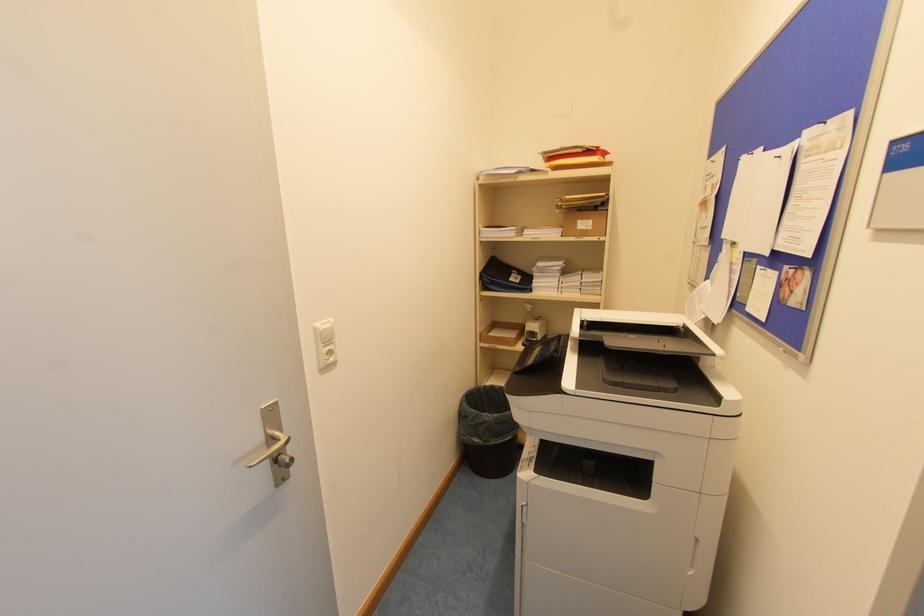
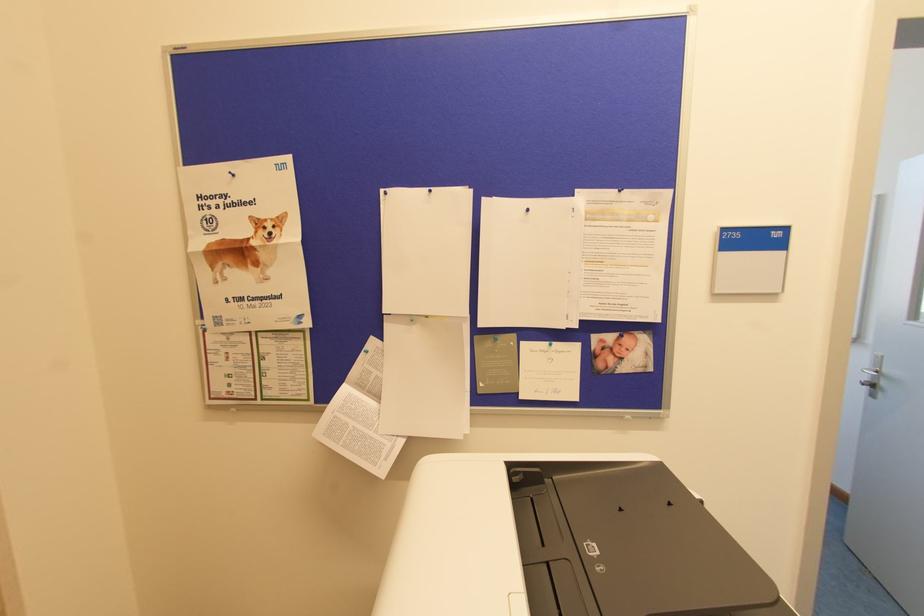
Locate, in the second image, the point that corresponds to pixel 714 323 in the first image.

(460, 438)